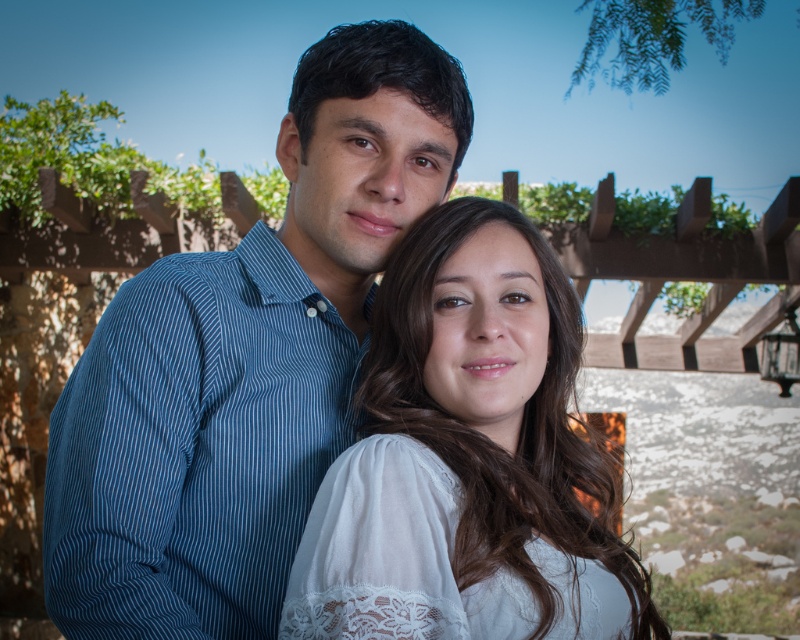
Question: Is blue striped shirt at center further to camera compared to white lace blouse at center?

Choices:
 (A) no
 (B) yes

Answer: (B)

Question: Can you confirm if blue striped shirt at center is wider than white lace blouse at center?

Choices:
 (A) no
 (B) yes

Answer: (B)

Question: Does blue striped shirt at center appear over white lace blouse at center?

Choices:
 (A) yes
 (B) no

Answer: (A)